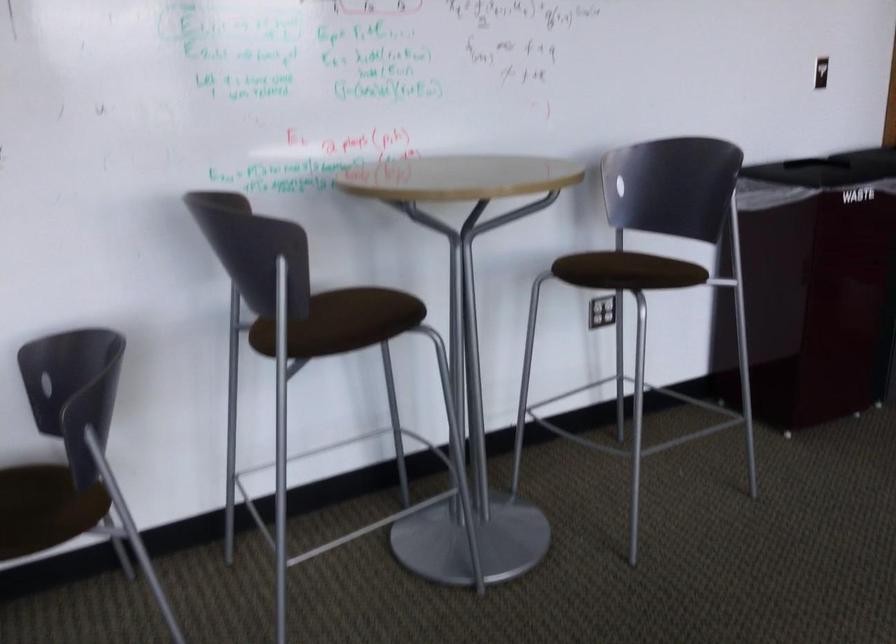
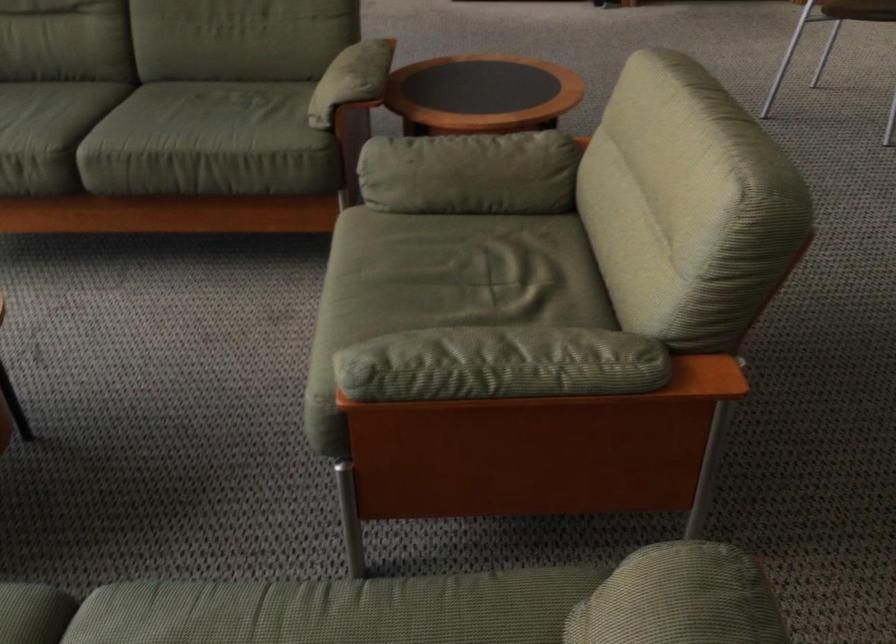
Based on the continuous images, in which direction is the camera rotating?

The rotation direction of the camera is left-down.